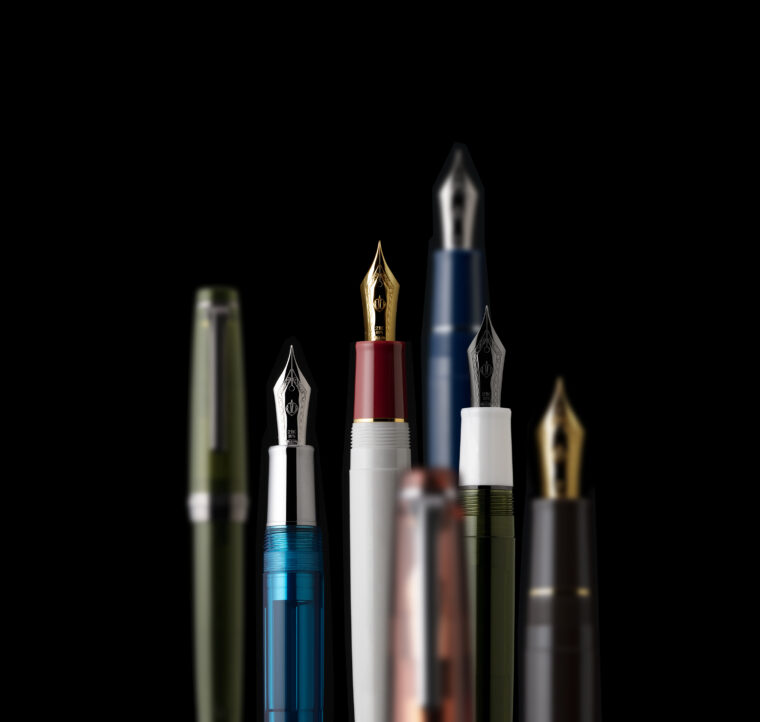
Locate an element on the screen. This screenshot has width=760, height=722. pens is located at coordinates (216, 408), (290, 458), (378, 336), (460, 240), (491, 378), (583, 477).